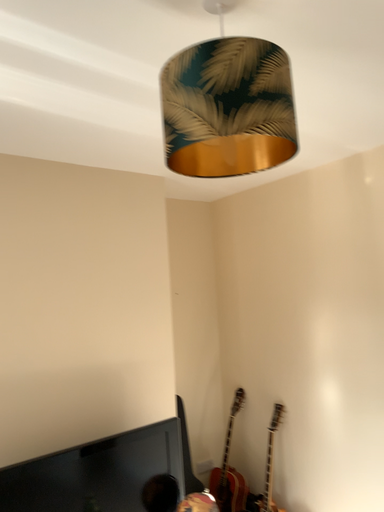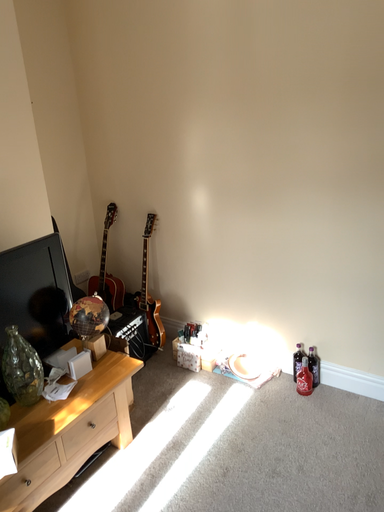
Question: Which way did the camera rotate in the video?

Choices:
 (A) rotated upward
 (B) rotated downward

Answer: (B)